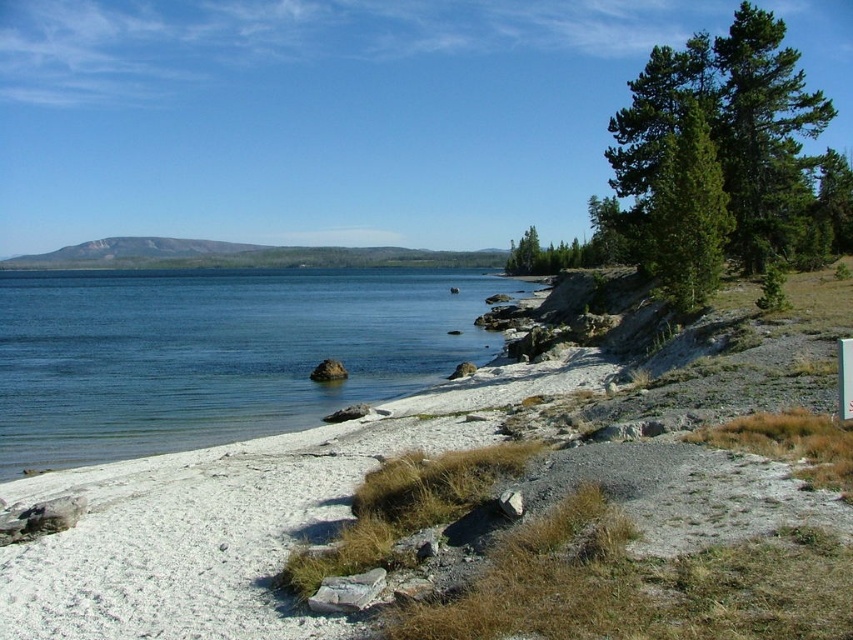
Does blue water at lower left come behind green textured pine tree at upper right?

No, it is not.

Does blue water at lower left have a greater height compared to green textured pine tree at upper right?

Correct, blue water at lower left is much taller as green textured pine tree at upper right.

What do you see at coordinates (216, 353) in the screenshot? The height and width of the screenshot is (640, 853). I see `blue water at lower left` at bounding box center [216, 353].

The image size is (853, 640). In order to click on blue water at lower left in this screenshot , I will do `click(216, 353)`.

Can you confirm if white gravelly sand at lower left is thinner than green textured pine tree at upper right?

No, white gravelly sand at lower left is not thinner than green textured pine tree at upper right.

Which is above, white gravelly sand at lower left or green textured pine tree at upper right?

green textured pine tree at upper right is above.

The image size is (853, 640). Describe the element at coordinates (477, 512) in the screenshot. I see `white gravelly sand at lower left` at that location.

The image size is (853, 640). In order to click on white gravelly sand at lower left in this screenshot , I will do `click(477, 512)`.

Which is more to the right, white gravelly sand at lower left or blue water at lower left?

Positioned to the right is white gravelly sand at lower left.

Is point (730, 508) positioned after point (227, 424)?

No.

Where is `white gravelly sand at lower left`? white gravelly sand at lower left is located at coordinates (477, 512).